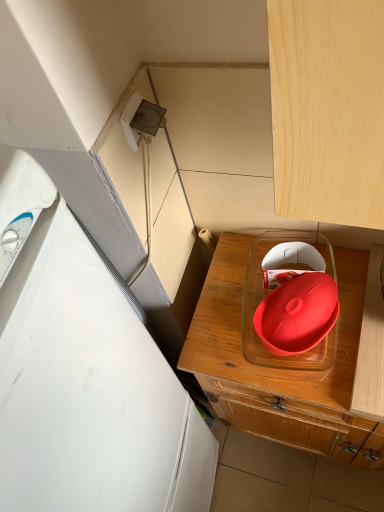
The width and height of the screenshot is (384, 512). Find the location of `vacant area on the back side of rubberized red lid at center`. vacant area on the back side of rubberized red lid at center is located at coordinates (243, 266).